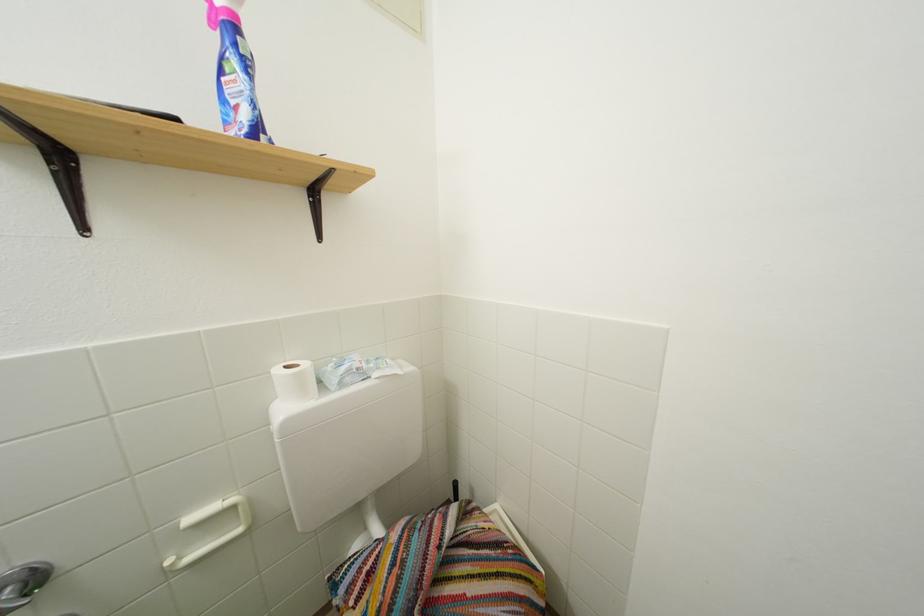
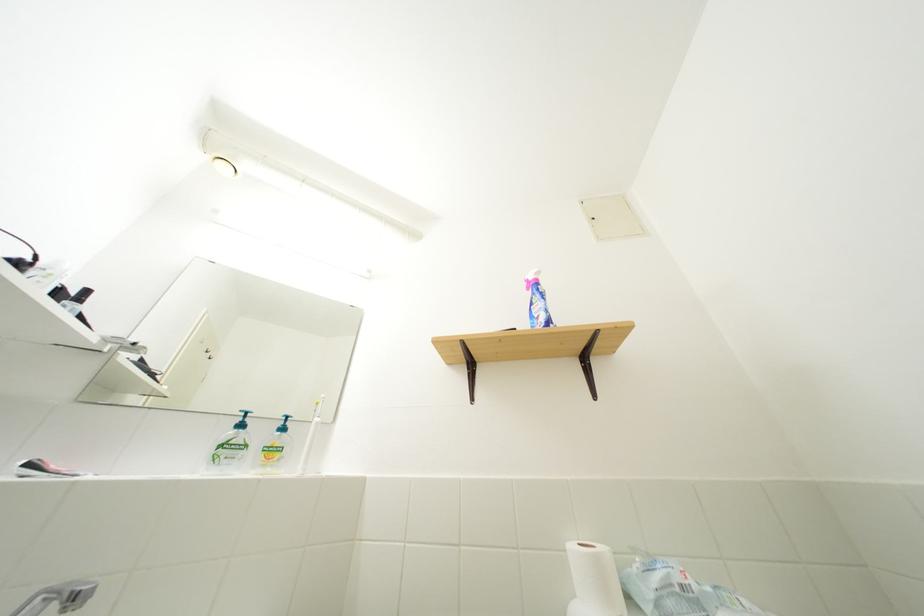
Find the pixel in the second image that matches (x=351, y=375) in the first image.

(665, 585)